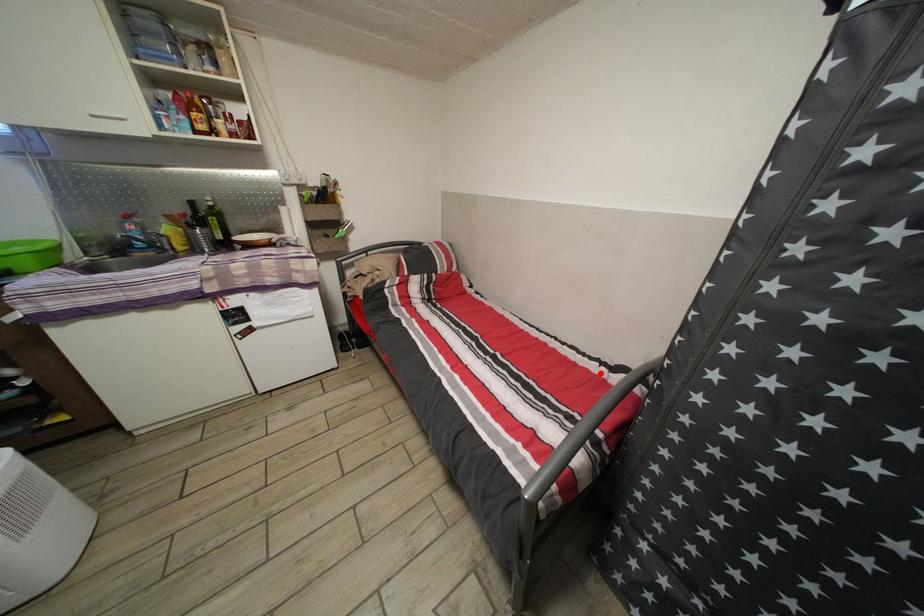
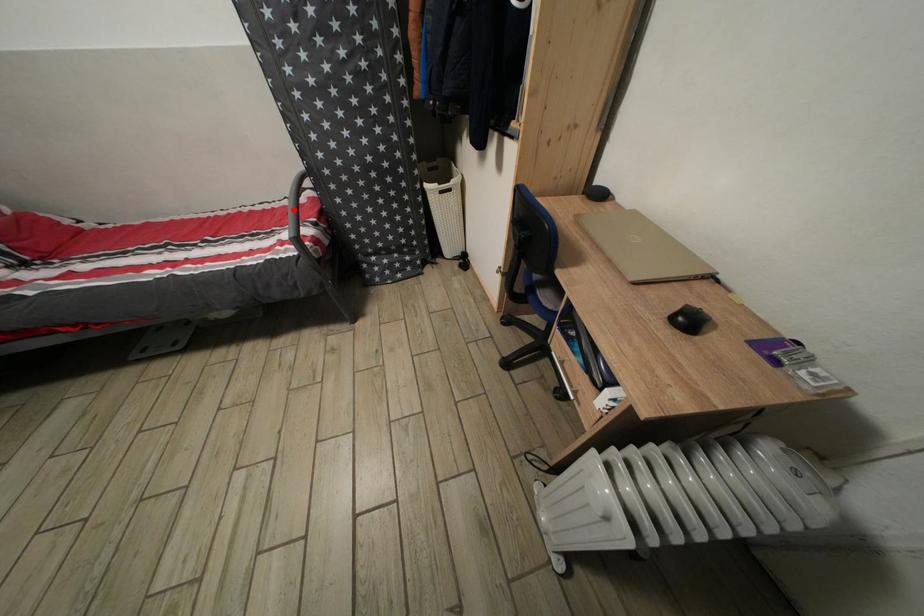
I am providing you with two images of the same scene from different viewpoints. A red point is marked on the first image and another point is marked on the second image. Do the highlighted points in image1 and image2 indicate the same real-world spot?

Yes